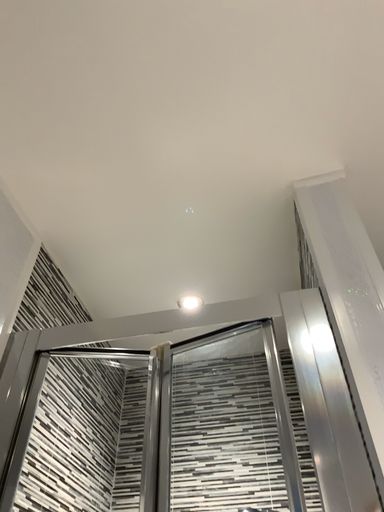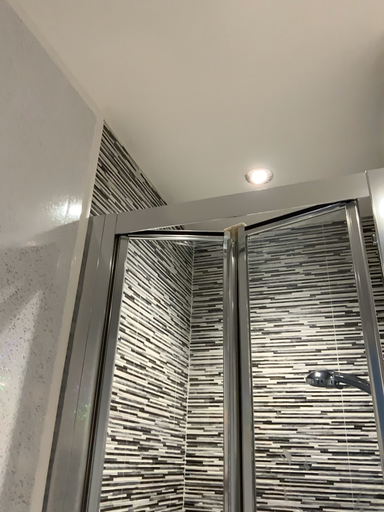
Question: How did the camera likely rotate when shooting the video?

Choices:
 (A) rotated right
 (B) rotated left

Answer: (B)